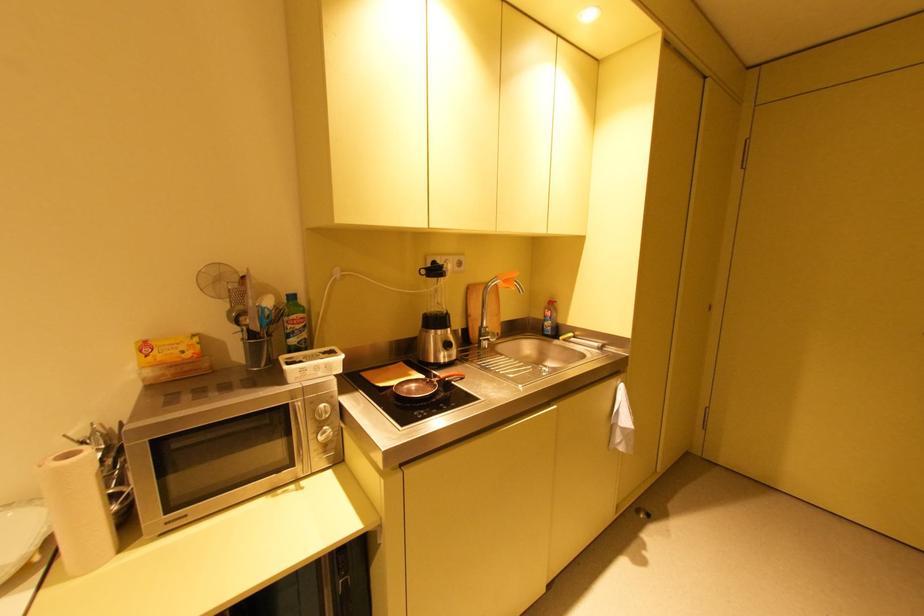
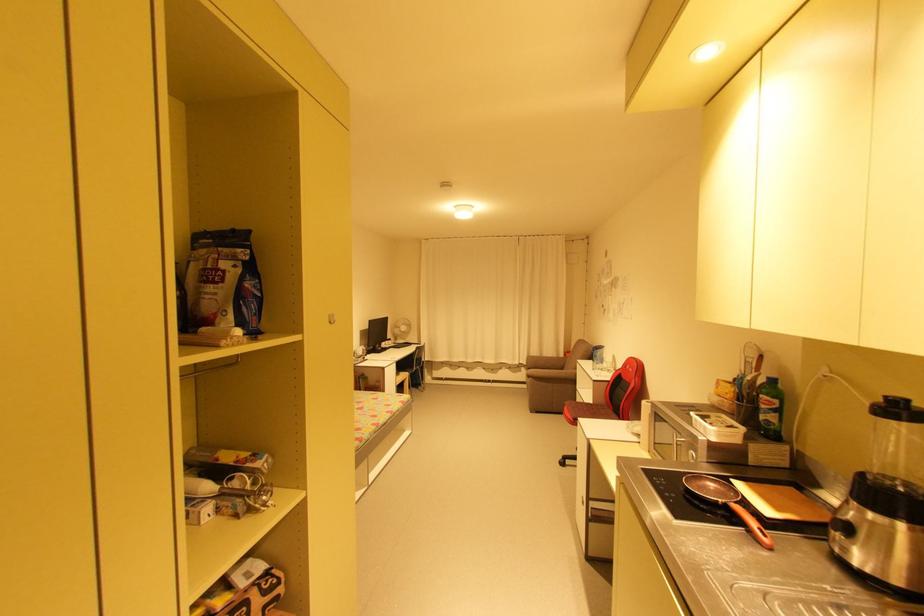
Find the pixel in the second image that matches pixel 308 323 in the first image.

(773, 406)